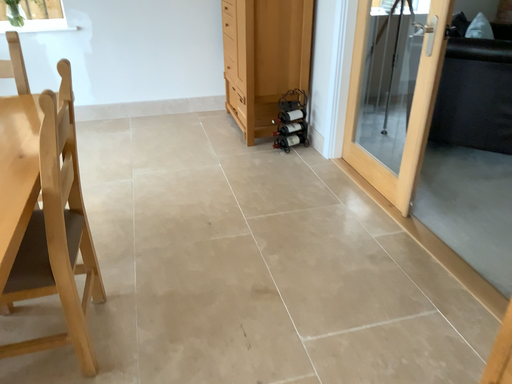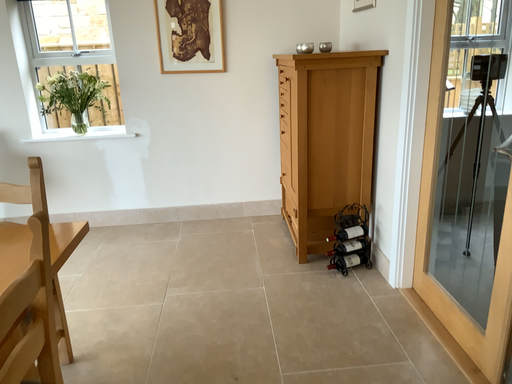
Question: Which way did the camera rotate in the video?

Choices:
 (A) rotated upward
 (B) rotated downward

Answer: (A)